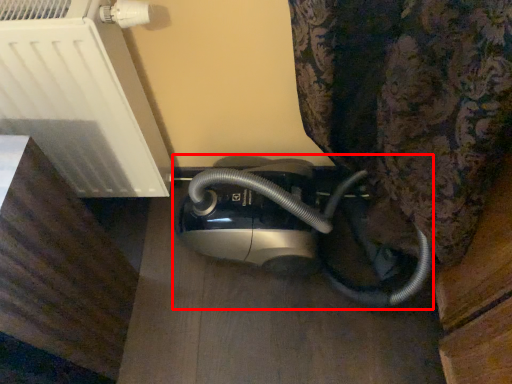
Question: From the image's perspective, where is home appliance (annotated by the red box) located relative to appliance?

Choices:
 (A) below
 (B) above

Answer: (A)